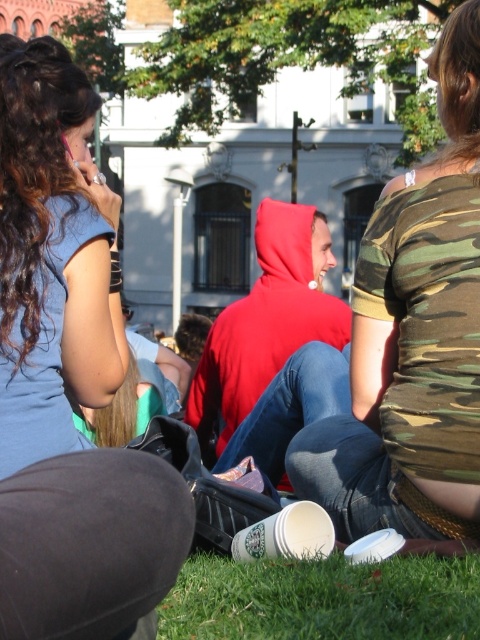
Does camouflage fabric shirt at center appear on the left side of green grass at lower center?

No, camouflage fabric shirt at center is not to the left of green grass at lower center.

Can you confirm if camouflage fabric shirt at center is shorter than green grass at lower center?

No, camouflage fabric shirt at center is not shorter than green grass at lower center.

Between point (420, 198) and point (387, 609), which one is positioned in front?

Point (387, 609) is in front.

Locate an element on the screen. This screenshot has height=640, width=480. camouflage fabric shirt at center is located at coordinates (414, 337).

Between point (56, 566) and point (194, 620), which one is positioned in front?

Point (56, 566)

Is matte blue shirt at upper left smaller than green grass at lower center?

No.

Between point (47, 257) and point (323, 580), which one is positioned behind?

The point (47, 257) is more distant.

Where is `matte blue shirt at upper left`? The width and height of the screenshot is (480, 640). matte blue shirt at upper left is located at coordinates (69, 378).

Between matte blue shirt at upper left and camouflage fabric shirt at center, which one is positioned higher?

camouflage fabric shirt at center

Is matte blue shirt at upper left thinner than camouflage fabric shirt at center?

Incorrect, matte blue shirt at upper left's width is not less than camouflage fabric shirt at center's.

Measure the distance between matte blue shirt at upper left and camera.

matte blue shirt at upper left is 9.09 feet from camera.

Locate an element on the screen. matte blue shirt at upper left is located at coordinates (69, 378).